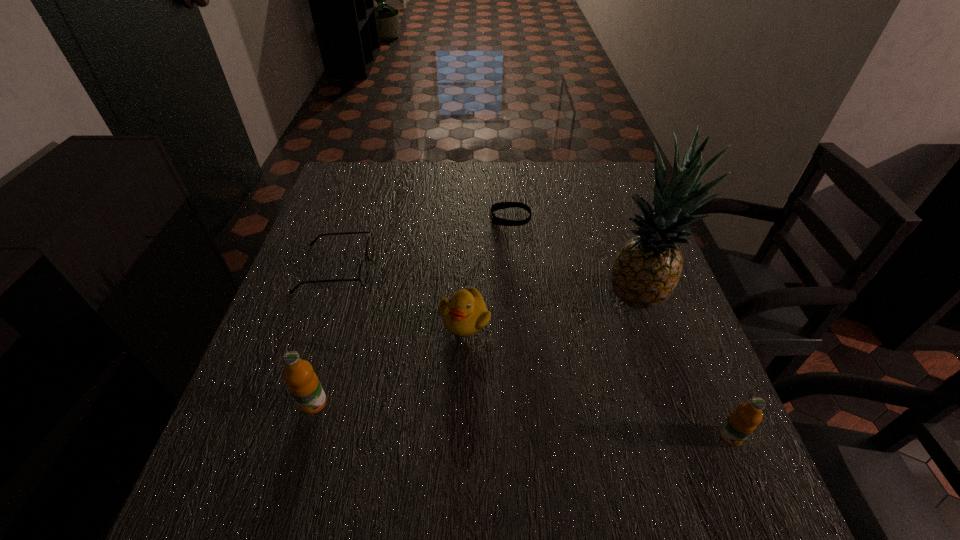
Where is `vacant space that is in between the duckling and the spectacles`? This screenshot has height=540, width=960. vacant space that is in between the duckling and the spectacles is located at coordinates (400, 294).

Locate an element on the screen. The image size is (960, 540). free spot between the wristband and the nearest object is located at coordinates (620, 327).

Identify the location of vacant point located between the second shortest object and the third shortest object. (400, 294).

Locate an element on the screen. The width and height of the screenshot is (960, 540). vacant region between the tallest object and the second nearest object is located at coordinates (476, 350).

Identify the location of vacant space in between the nearest object and the taller orange juice. The width and height of the screenshot is (960, 540). (522, 420).

You are a GUI agent. You are given a task and a screenshot of the screen. Output one action in this format:
    pyautogui.click(x=<x>, y=<y>)
    Task: Click on the vacant point located between the second nearest object and the spectacles
    The width and height of the screenshot is (960, 540).
    Given the screenshot: What is the action you would take?
    pyautogui.click(x=324, y=336)

Where is `vacant area that lies between the pineapple and the spectacles`? vacant area that lies between the pineapple and the spectacles is located at coordinates (488, 283).

The height and width of the screenshot is (540, 960). Identify the location of unoccupied area between the tallest object and the spectacles. (488, 283).

This screenshot has height=540, width=960. I want to click on free spot between the fourth tallest object and the spectacles, so click(400, 294).

Identify which object is the fourth closest to the second nearest object. Please provide its 2D coordinates. Your answer should be formatted as a tuple, i.e. [(x, y)], where the tuple contains the x and y coordinates of a point satisfying the conditions above.

[(647, 269)]